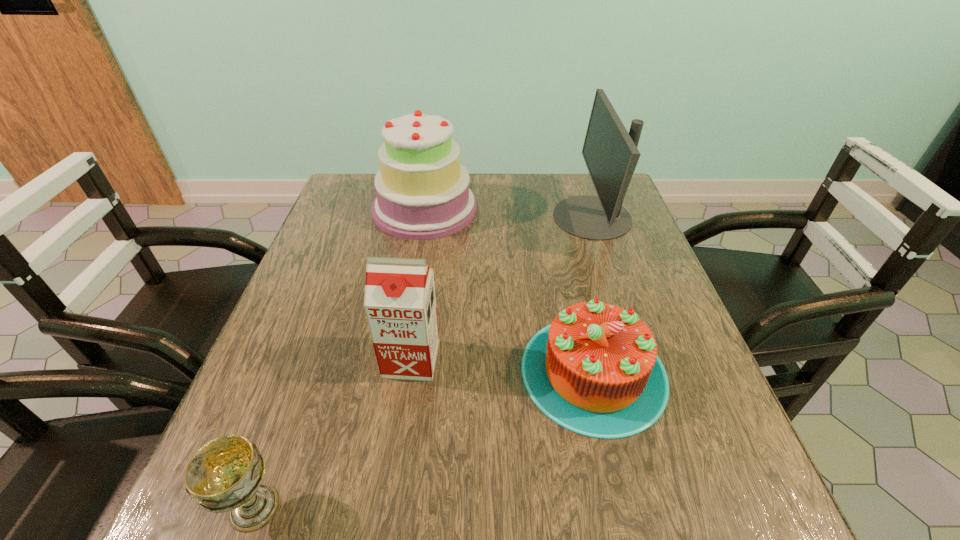
The image size is (960, 540). Find the location of `vacant position located 0.060m on the left of the soya milk`. vacant position located 0.060m on the left of the soya milk is located at coordinates (354, 359).

Find the location of `free point located on the left of the nearer cake`. free point located on the left of the nearer cake is located at coordinates (394, 372).

This screenshot has height=540, width=960. Identify the location of computer monitor present at the far edge. (610, 153).

At what (x,y) coordinates should I click in order to perform the action: click on cake at the far edge. Please return your answer as a coordinate pair (x, y). The height and width of the screenshot is (540, 960). Looking at the image, I should click on (422, 190).

Find the location of a particular element. The height and width of the screenshot is (540, 960). object present at the left edge is located at coordinates (422, 190).

Where is `computer monitor that is at the right edge`? Image resolution: width=960 pixels, height=540 pixels. computer monitor that is at the right edge is located at coordinates (610, 153).

This screenshot has height=540, width=960. Find the location of `cake that is positioned at the right edge`. cake that is positioned at the right edge is located at coordinates (594, 370).

Locate an element on the screen. object present at the far left corner is located at coordinates point(422,190).

You are a GUI agent. You are given a task and a screenshot of the screen. Output one action in this format:
    pyautogui.click(x=<x>, y=<y>)
    Task: Click on the object located in the far right corner section of the desktop
    The width and height of the screenshot is (960, 540).
    Given the screenshot: What is the action you would take?
    pyautogui.click(x=610, y=153)

Where is `vacant space at the far edge`? vacant space at the far edge is located at coordinates (471, 186).